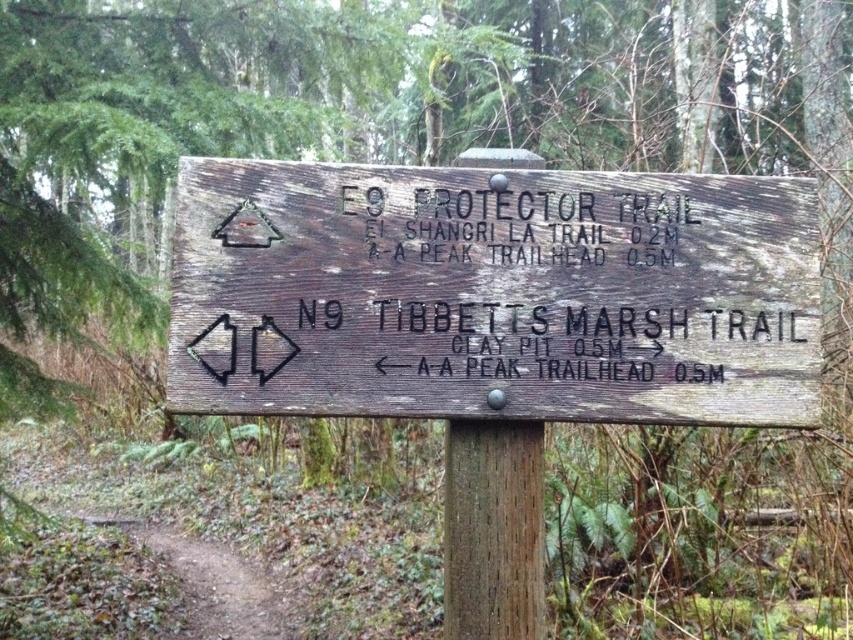
Question: Based on their relative distances, which object is nearer to the weathered brown wood at center?

Choices:
 (A) weathered wood sign at center
 (B) brown dirt path at lower left

Answer: (A)

Question: Which point appears closest to the camera in this image?

Choices:
 (A) (476, 451)
 (B) (268, 616)
 (C) (310, 288)

Answer: (C)

Question: Which point is farther to the camera?

Choices:
 (A) (422, 365)
 (B) (485, 547)

Answer: (B)

Question: Does weathered brown wood at center lie behind brown dirt path at lower left?

Choices:
 (A) yes
 (B) no

Answer: (B)

Question: From the image, what is the correct spatial relationship of weathered brown wood at center in relation to brown dirt path at lower left?

Choices:
 (A) left
 (B) right

Answer: (B)

Question: Is weathered wood sign at center bigger than brown dirt path at lower left?

Choices:
 (A) yes
 (B) no

Answer: (B)